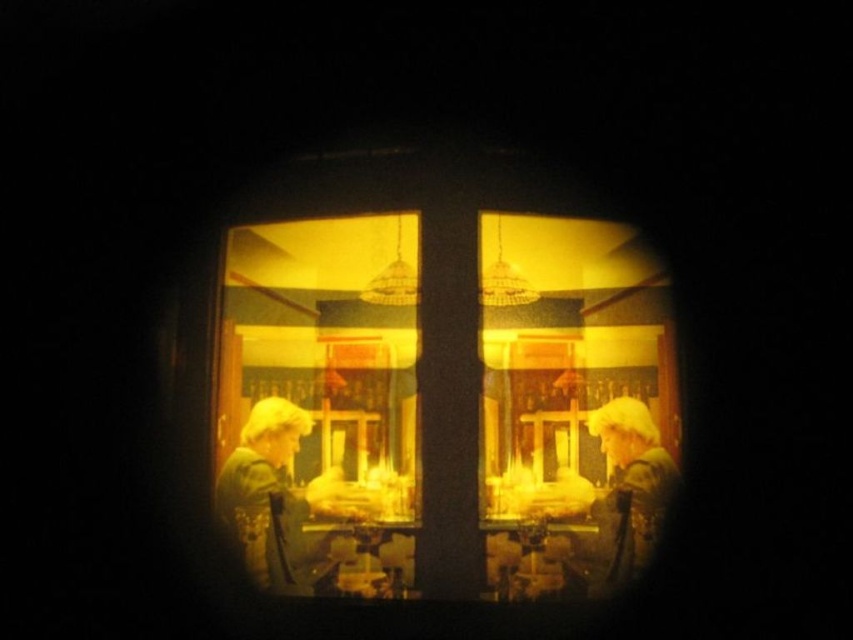
Based on the scene description, where is the matte glass shop window at center located in the image?

The matte glass shop window at center is located at point coordinates of 0.631 in the x axis and 0.521 in the y axis.

You are standing in front of the scene and want to place a small decoration between the matte glass shop window at center and the matte silver helmet at center. Based on their positions, which object should the decoration be closer to?

The decoration should be placed closer to the matte silver helmet at center because the matte glass shop window at center is positioned to the left of the matte silver helmet at center.